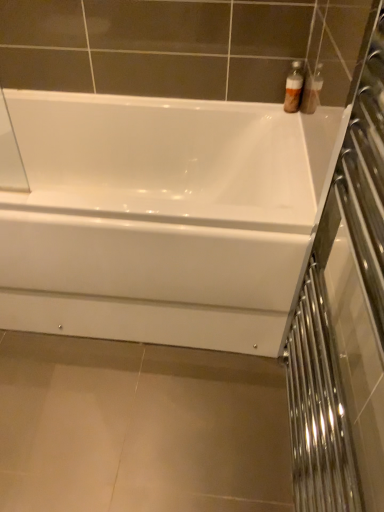
Question: Should I look upward or downward to see white glossy bathtub at center?

Choices:
 (A) up
 (B) down

Answer: (A)

Question: From a real-world perspective, is translucent plastic bottles at upper right under clear glass screen door at right?

Choices:
 (A) no
 (B) yes

Answer: (B)

Question: Does translucent plastic bottles at upper right have a lesser height compared to clear glass screen door at right?

Choices:
 (A) yes
 (B) no

Answer: (A)

Question: Would you say translucent plastic bottles at upper right is outside clear glass screen door at right?

Choices:
 (A) yes
 (B) no

Answer: (A)

Question: Is translucent plastic bottles at upper right thinner than clear glass screen door at right?

Choices:
 (A) yes
 (B) no

Answer: (A)

Question: Does translucent plastic bottles at upper right have a larger size compared to clear glass screen door at right?

Choices:
 (A) yes
 (B) no

Answer: (B)

Question: Does translucent plastic bottles at upper right appear on the left side of clear glass screen door at right?

Choices:
 (A) yes
 (B) no

Answer: (B)

Question: Would you say translucent plastic bottles at upper right contains white glossy bathtub at center?

Choices:
 (A) no
 (B) yes

Answer: (A)

Question: Is translucent plastic bottles at upper right shorter than white glossy bathtub at center?

Choices:
 (A) no
 (B) yes

Answer: (B)

Question: Is translucent plastic bottles at upper right not close to white glossy bathtub at center?

Choices:
 (A) no
 (B) yes

Answer: (A)

Question: Is translucent plastic bottles at upper right wider than white glossy bathtub at center?

Choices:
 (A) no
 (B) yes

Answer: (A)

Question: Would you say translucent plastic bottles at upper right is outside white glossy bathtub at center?

Choices:
 (A) yes
 (B) no

Answer: (A)

Question: Is translucent plastic bottles at upper right oriented away from white glossy bathtub at center?

Choices:
 (A) yes
 (B) no

Answer: (B)

Question: From a real-world perspective, is clear glass screen door at right physically above translucent plastic bottles at upper right?

Choices:
 (A) yes
 (B) no

Answer: (A)